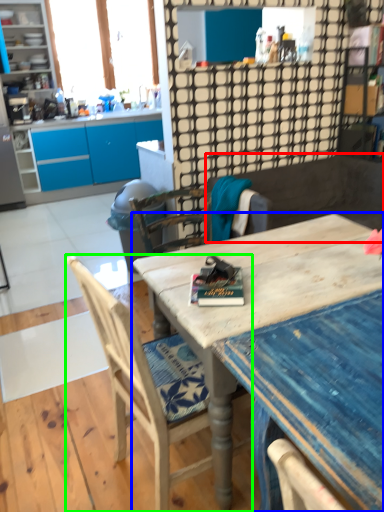
Question: Estimate the real-world distances between objects in this image. Which object is closer to wide (highlighted by a red box), desk (highlighted by a blue box) or chair (highlighted by a green box)?

Choices:
 (A) desk
 (B) chair

Answer: (A)